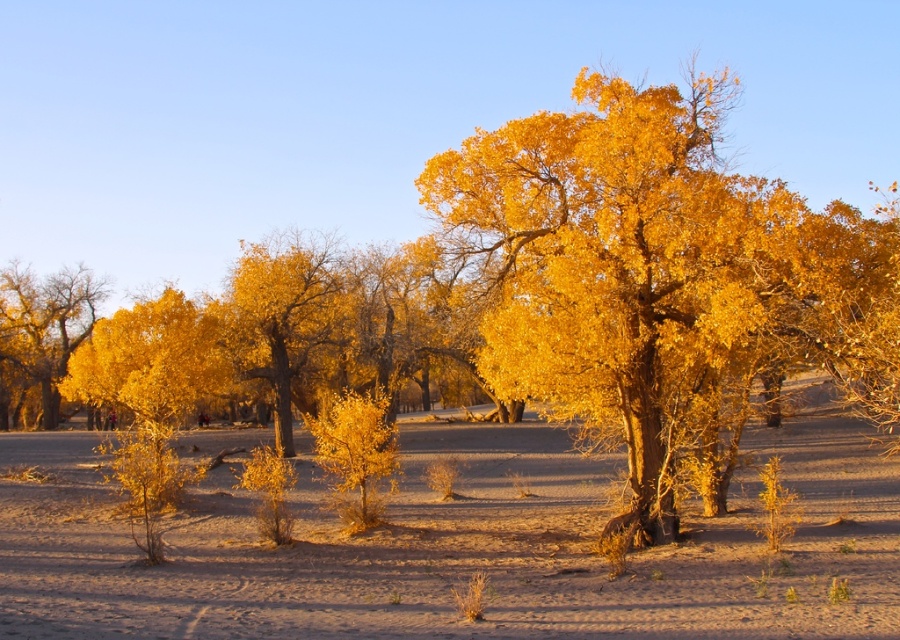
Question: Which point is closer to the camera taking this photo?

Choices:
 (A) (869, 292)
 (B) (50, 372)

Answer: (A)

Question: Considering the relative positions of dried sand at center and golden textured tree at center in the image provided, where is dried sand at center located with respect to golden textured tree at center?

Choices:
 (A) right
 (B) left

Answer: (B)

Question: Which point is closer to the camera?

Choices:
 (A) golden textured tree at center
 (B) golden textured bush at left
 (C) golden matte tree at center
 (D) dried sand at center

Answer: (D)

Question: Can you confirm if dried sand at center is bigger than golden textured tree at center?

Choices:
 (A) no
 (B) yes

Answer: (A)

Question: Which point is farther to the camera?

Choices:
 (A) click(x=707, y=428)
 (B) click(x=333, y=307)
 (C) click(x=40, y=324)
 (D) click(x=794, y=465)

Answer: (C)

Question: Does dried sand at center have a lesser width compared to golden matte tree at center?

Choices:
 (A) no
 (B) yes

Answer: (A)